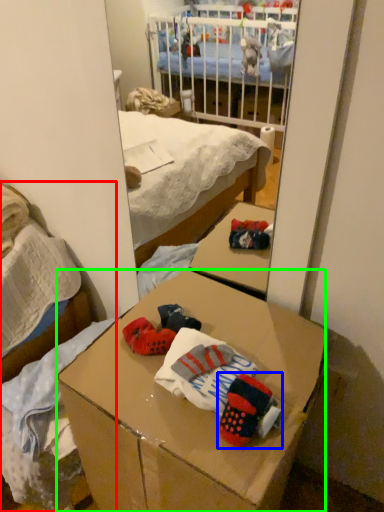
Question: Estimate the real-world distances between objects in this image. Which object is closer to bed (highlighted by a red box), toy (highlighted by a blue box) or desk (highlighted by a green box)?

Choices:
 (A) toy
 (B) desk

Answer: (B)